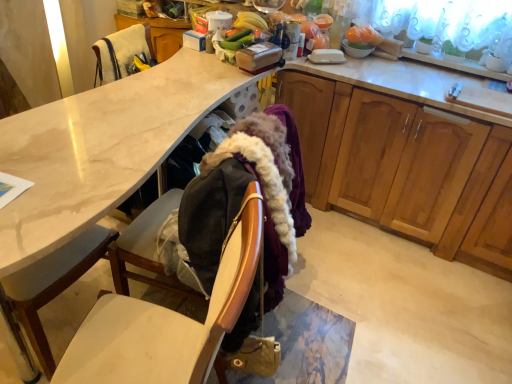
Question: From the image's perspective, is matte white desk at center under wooden cabinets at right?

Choices:
 (A) no
 (B) yes

Answer: (B)

Question: From a real-world perspective, is matte white desk at center on top of wooden cabinets at right?

Choices:
 (A) yes
 (B) no

Answer: (B)

Question: Is matte white desk at center surrounding wooden cabinets at right?

Choices:
 (A) yes
 (B) no

Answer: (B)

Question: Is matte white desk at center in contact with wooden cabinets at right?

Choices:
 (A) yes
 (B) no

Answer: (B)

Question: Considering the relative sizes of matte white desk at center and wooden cabinets at right in the image provided, is matte white desk at center wider than wooden cabinets at right?

Choices:
 (A) yes
 (B) no

Answer: (B)

Question: Is matte white desk at center aimed at wooden cabinets at right?

Choices:
 (A) yes
 (B) no

Answer: (A)

Question: Is white glossy bowl at upper right positioned far away from orange plastic bag at upper right?

Choices:
 (A) yes
 (B) no

Answer: (B)

Question: Are white glossy bowl at upper right and orange plastic bag at upper right making contact?

Choices:
 (A) yes
 (B) no

Answer: (A)

Question: From the image's perspective, is white glossy bowl at upper right over orange plastic bag at upper right?

Choices:
 (A) no
 (B) yes

Answer: (A)

Question: Is white glossy bowl at upper right aimed at orange plastic bag at upper right?

Choices:
 (A) no
 (B) yes

Answer: (A)

Question: Can you confirm if white glossy bowl at upper right is shorter than orange plastic bag at upper right?

Choices:
 (A) no
 (B) yes

Answer: (B)

Question: Considering the relative sizes of white glossy bowl at upper right and orange plastic bag at upper right in the image provided, is white glossy bowl at upper right bigger than orange plastic bag at upper right?

Choices:
 (A) no
 (B) yes

Answer: (A)

Question: Is velvet-like fabric armchair at upper left to the left of green matte plant at upper right from the viewer's perspective?

Choices:
 (A) yes
 (B) no

Answer: (A)